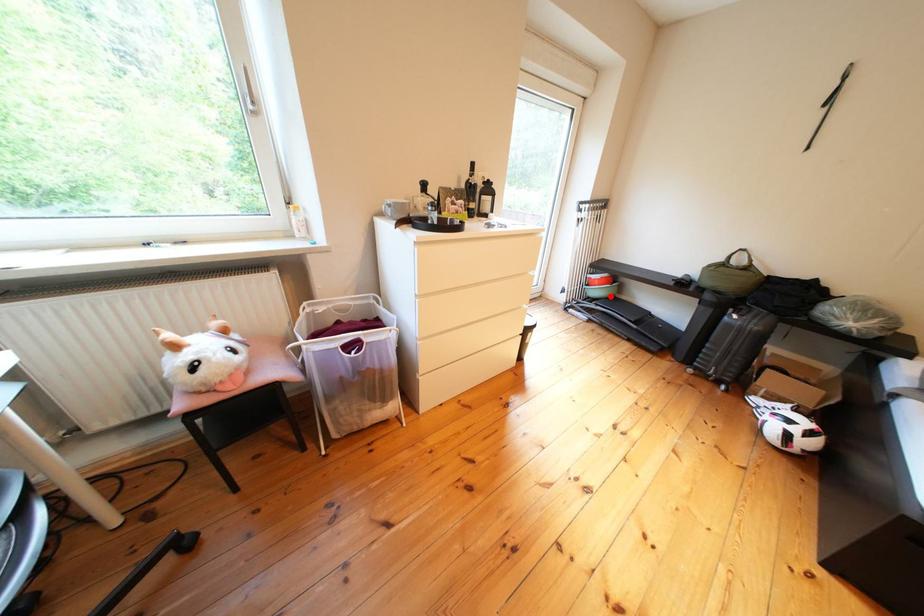
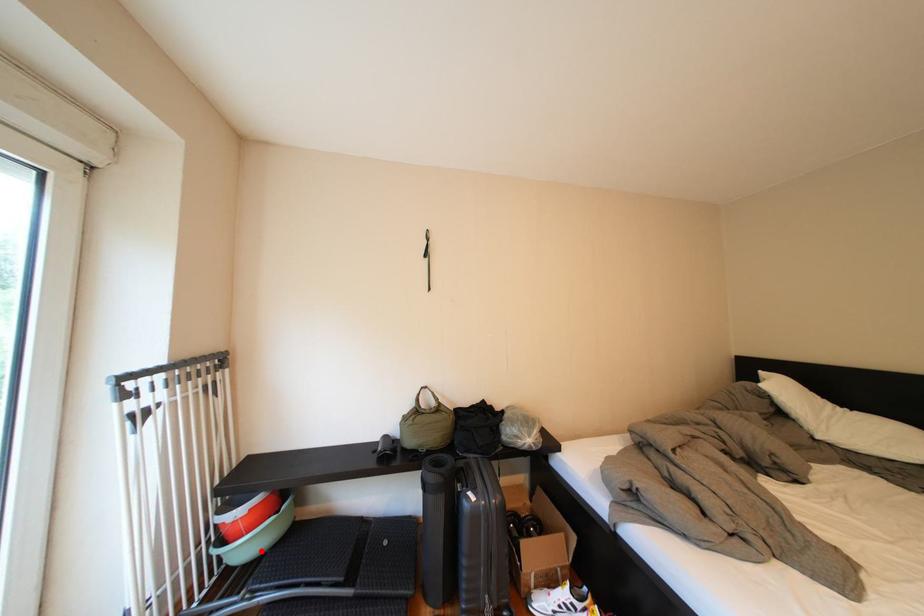
I am providing you with two images of the same scene from different viewpoints. A red point is marked on the first image and another point is marked on the second image. Is the red point in image1 aligned with the point shown in image2?

Yes